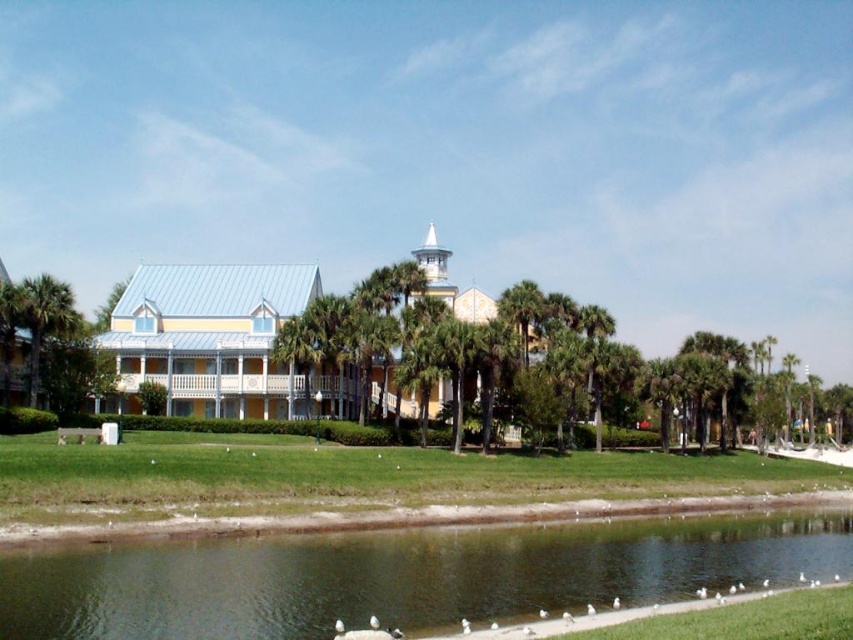
Question: Which point is closer to the camera taking this photo?

Choices:
 (A) (415, 534)
 (B) (45, 284)

Answer: (A)

Question: Does green grassy bank at lower center have a greater width compared to green leafy palm tree at left?

Choices:
 (A) yes
 (B) no

Answer: (A)

Question: Is green grassy bank at lower center bigger than green leafy palm tree at left?

Choices:
 (A) no
 (B) yes

Answer: (A)

Question: Among these points, which one is farthest from the camera?

Choices:
 (A) (68, 301)
 (B) (236, 627)

Answer: (A)

Question: Is green grassy bank at lower center to the left of green leafy palm tree at left from the viewer's perspective?

Choices:
 (A) no
 (B) yes

Answer: (A)